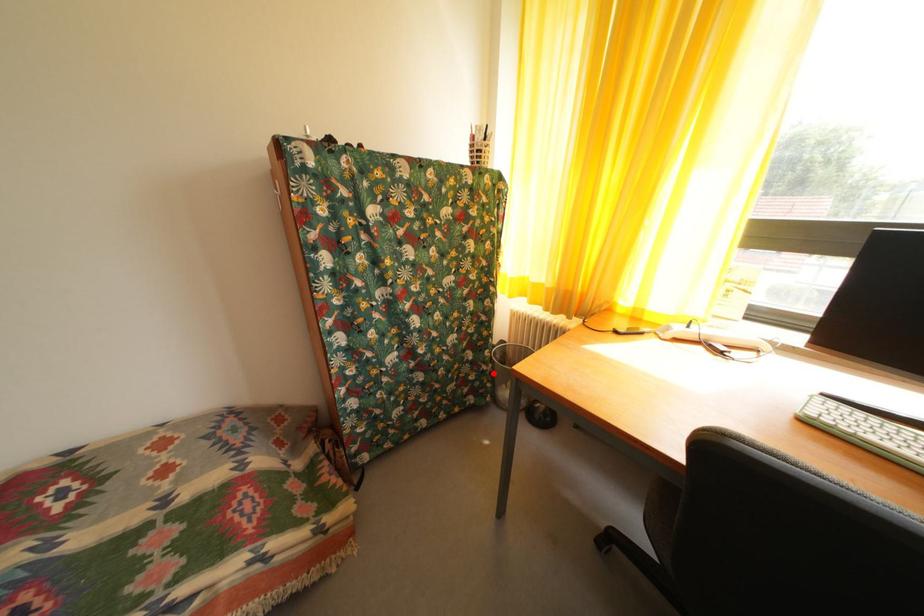
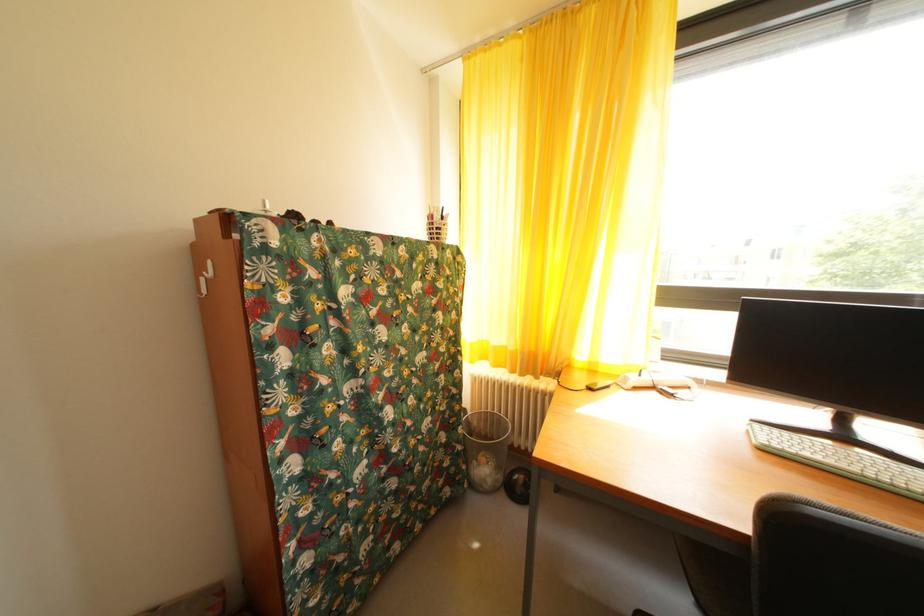
Question: I am providing you with two images of the same scene from different viewpoints. Image1 has a red point marked. In image2, the corresponding 3D location appears at what relative position? Reply with the corresponding letter.

Choices:
 (A) Closer
 (B) Farther

Answer: (A)